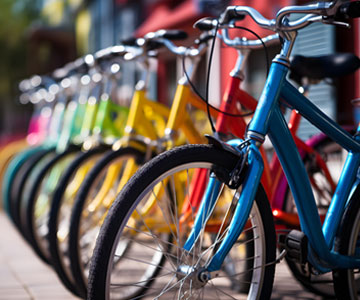
Where is `forks`? This screenshot has width=360, height=300. forks is located at coordinates (252, 176), (215, 183), (202, 180), (197, 175), (157, 189), (131, 168), (109, 182), (78, 181), (55, 171).